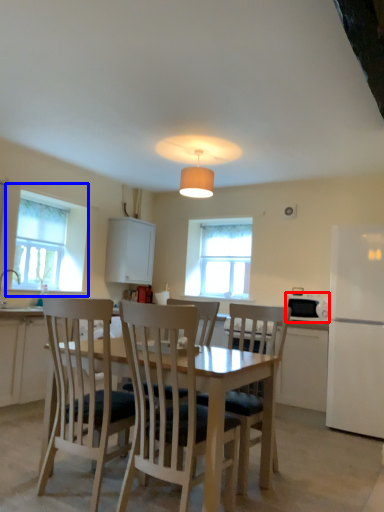
Question: Among these objects, which one is farthest to the camera, appliance (highlighted by a red box) or window (highlighted by a blue box)?

Choices:
 (A) appliance
 (B) window

Answer: (B)